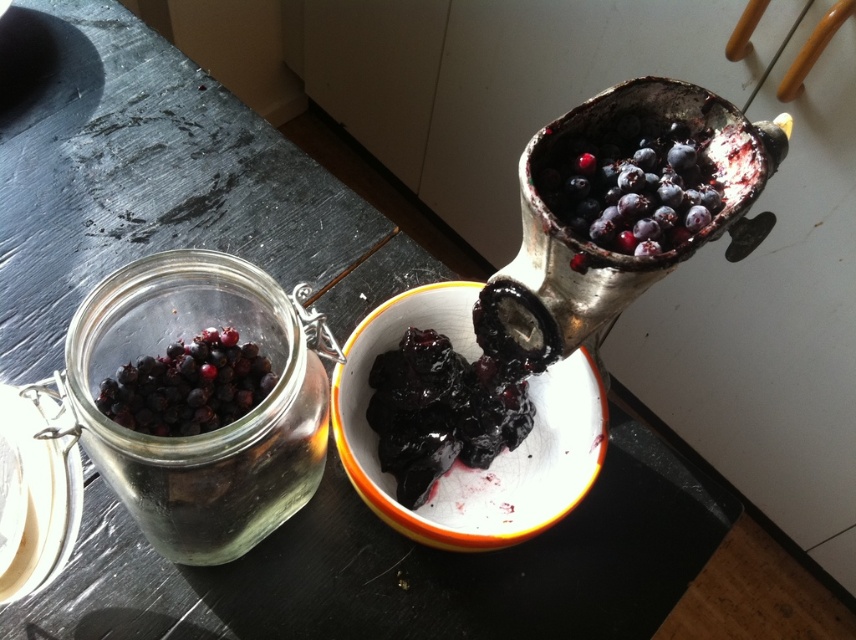
Looking at this image, who is taller, transparent glass jar at left or shiny dark blue berries at upper right?

With more height is transparent glass jar at left.

Can you confirm if transparent glass jar at left is wider than shiny dark blue berries at upper right?

Indeed, transparent glass jar at left has a greater width compared to shiny dark blue berries at upper right.

Who is more distant from viewer, [247,420] or [654,132]?

The point [654,132] is behind.

Where is `transparent glass jar at left`? transparent glass jar at left is located at coordinates (215, 428).

Does transparent glass jar at left appear under matte white bowl at center?

No, transparent glass jar at left is not below matte white bowl at center.

Can you confirm if transparent glass jar at left is bigger than matte white bowl at center?

Correct, transparent glass jar at left is larger in size than matte white bowl at center.

What do you see at coordinates (215, 428) in the screenshot? I see `transparent glass jar at left` at bounding box center [215, 428].

Where is `transparent glass jar at left`? The height and width of the screenshot is (640, 856). transparent glass jar at left is located at coordinates (215, 428).

The image size is (856, 640). I want to click on shiny dark blue berries at upper right, so click(632, 186).

Is shiny dark blue berries at upper right closer to camera compared to glossy glass jar at left?

That is True.

This screenshot has width=856, height=640. In order to click on shiny dark blue berries at upper right in this screenshot , I will do `click(632, 186)`.